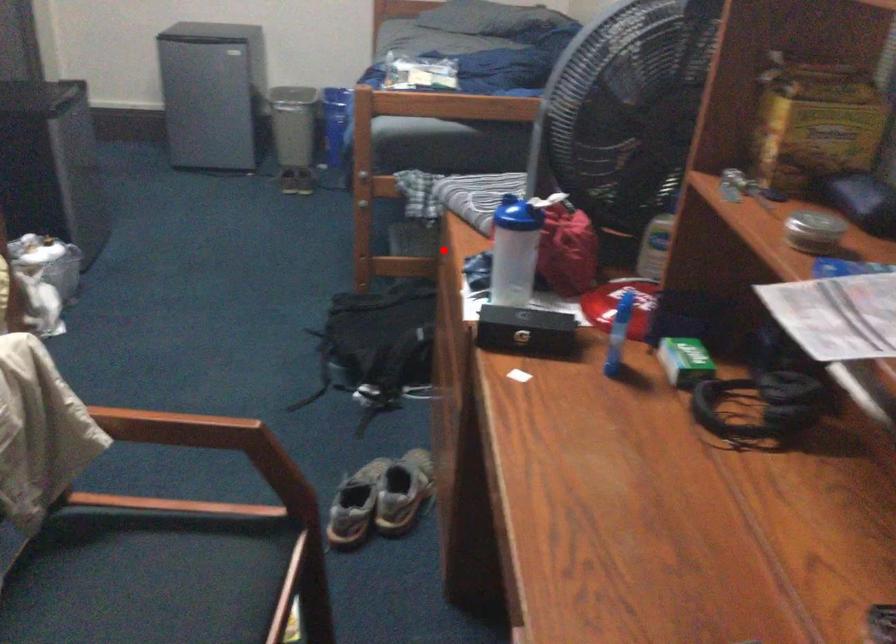
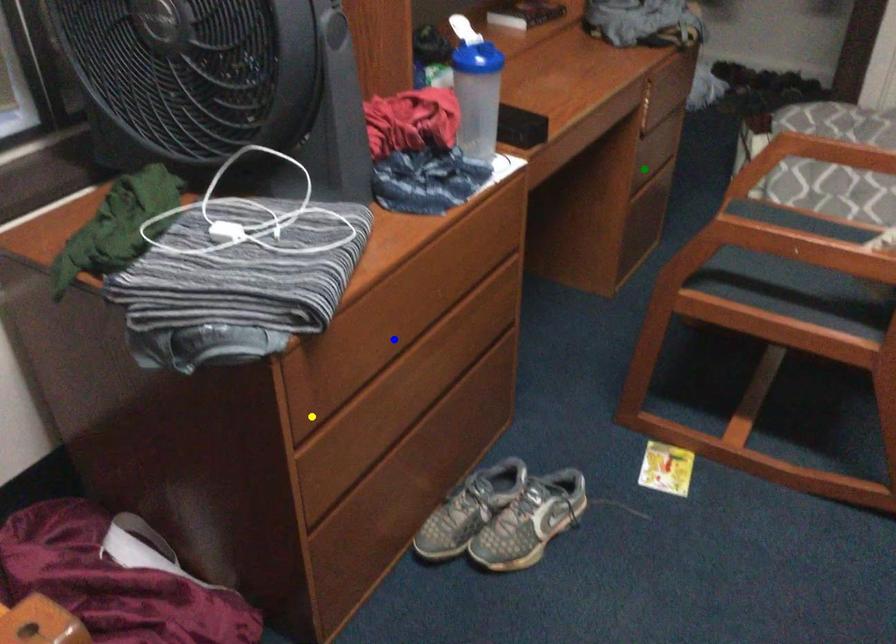
Question: I am providing you with two images of the same scene from different viewpoints. A red point is marked on the first image. You are given multiple points on the second image. Which point in image 2 is actually the same real-world point as the red point in image 1?

Choices:
 (A) green point
 (B) blue point
 (C) yellow point

Answer: (C)